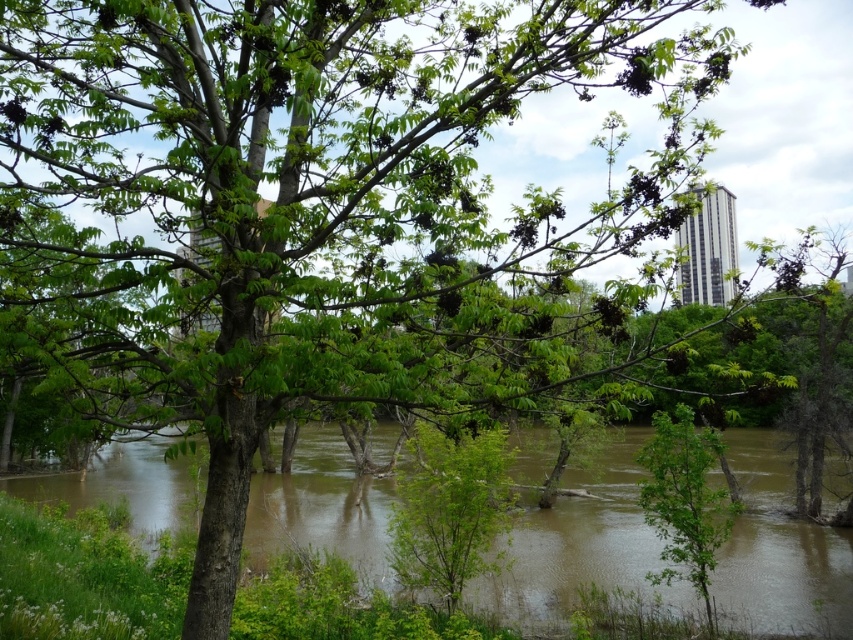
Question: Which of the following is the farthest from the observer?

Choices:
 (A) (451, 525)
 (B) (360, 522)

Answer: (B)

Question: Considering the relative positions of brown muddy water at lower left and green leafy tree at center in the image provided, where is brown muddy water at lower left located with respect to green leafy tree at center?

Choices:
 (A) left
 (B) right

Answer: (A)

Question: Can you confirm if brown muddy water at lower left is positioned above green leafy tree at center?

Choices:
 (A) no
 (B) yes

Answer: (A)

Question: Is brown muddy water at lower left further to camera compared to green leafy tree at center?

Choices:
 (A) no
 (B) yes

Answer: (A)